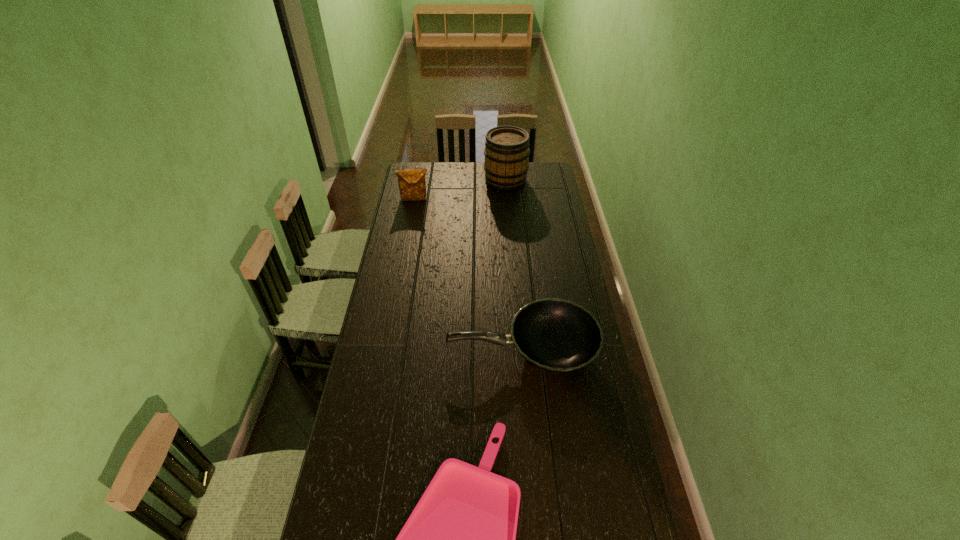
Locate an element on the screen. cider is located at coordinates (506, 151).

Identify the location of the farthest object. (506, 151).

The image size is (960, 540). Identify the location of the second tallest object. (412, 185).

This screenshot has height=540, width=960. Identify the location of the leftmost object. pos(412,185).

Find the location of a particular element. frying pan is located at coordinates (558, 336).

Locate an element on the screen. The width and height of the screenshot is (960, 540). the second nearest object is located at coordinates (558, 336).

The width and height of the screenshot is (960, 540). I want to click on vacant region located 0.230m on the front of the farthest object, so click(x=509, y=216).

Find the location of a particular element. blank space located 0.230m on the open side of the clutch bag is located at coordinates (409, 228).

Locate an element on the screen. This screenshot has width=960, height=540. free space located 0.300m on the back of the frying pan is located at coordinates (516, 269).

This screenshot has height=540, width=960. In order to click on object present at the far edge in this screenshot , I will do `click(506, 151)`.